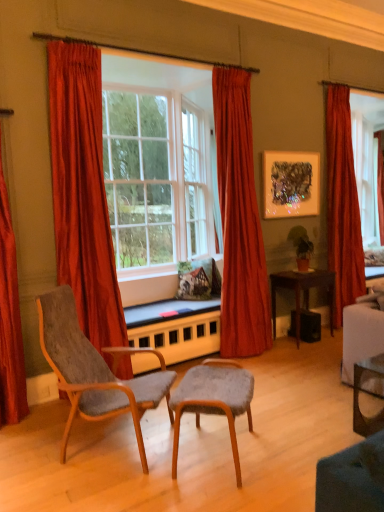
Question: Is velvet red curtain at center, placed as the second curtain when sorted from right to left, located within textured gray fabric chair at lower left, which ranks as the first chair in left-to-right order?

Choices:
 (A) yes
 (B) no

Answer: (B)

Question: From a real-world perspective, is textured gray fabric chair at lower left, which ranks as the first chair in left-to-right order, over velvet red curtain at center, placed as the second curtain when sorted from right to left?

Choices:
 (A) no
 (B) yes

Answer: (A)

Question: Considering the relative sizes of textured gray fabric chair at lower left, which ranks as the first chair in left-to-right order, and velvet red curtain at center, placed as the second curtain when sorted from right to left, in the image provided, is textured gray fabric chair at lower left, which ranks as the first chair in left-to-right order, thinner than velvet red curtain at center, placed as the second curtain when sorted from right to left,?

Choices:
 (A) no
 (B) yes

Answer: (A)

Question: Considering the relative sizes of textured gray fabric chair at lower left, marked as the 2th chair in a right-to-left arrangement, and velvet red curtain at center, placed as the second curtain when sorted from right to left, in the image provided, is textured gray fabric chair at lower left, marked as the 2th chair in a right-to-left arrangement, wider than velvet red curtain at center, placed as the second curtain when sorted from right to left,?

Choices:
 (A) no
 (B) yes

Answer: (B)

Question: Are textured gray fabric chair at lower left, which ranks as the first chair in left-to-right order, and velvet red curtain at center, placed as the second curtain when sorted from right to left, beside each other?

Choices:
 (A) no
 (B) yes

Answer: (A)

Question: Can you confirm if textured gray fabric chair at lower left, marked as the 2th chair in a right-to-left arrangement, is bigger than velvet red curtain at center, arranged as the third curtain when viewed from the left?

Choices:
 (A) no
 (B) yes

Answer: (A)

Question: Is metallic textured artwork at upper right positioned before velvet red curtain at left, the third curtain in the right-to-left sequence?

Choices:
 (A) no
 (B) yes

Answer: (A)

Question: Is metallic textured artwork at upper right at the left side of velvet red curtain at left, the third curtain in the right-to-left sequence?

Choices:
 (A) no
 (B) yes

Answer: (A)

Question: Does metallic textured artwork at upper right have a lesser height compared to velvet red curtain at left, the second curtain viewed from the left?

Choices:
 (A) yes
 (B) no

Answer: (A)

Question: Does metallic textured artwork at upper right have a greater height compared to velvet red curtain at left, the third curtain in the right-to-left sequence?

Choices:
 (A) no
 (B) yes

Answer: (A)

Question: Is metallic textured artwork at upper right placed right next to velvet red curtain at left, the third curtain in the right-to-left sequence?

Choices:
 (A) no
 (B) yes

Answer: (A)

Question: Is metallic textured artwork at upper right facing towards velvet red curtain at left, the second curtain viewed from the left?

Choices:
 (A) no
 (B) yes

Answer: (A)

Question: Is metallic textured artwork at upper right in front of clear glass desk at lower right, the 2th desk viewed from the back?

Choices:
 (A) no
 (B) yes

Answer: (A)